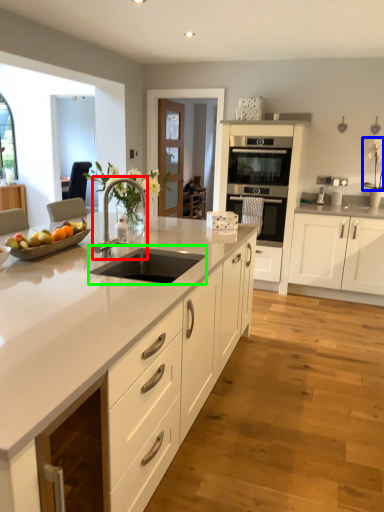
Question: Which is farther away from tap (highlighted by a red box)? flower (highlighted by a blue box) or sink (highlighted by a green box)?

Choices:
 (A) flower
 (B) sink

Answer: (A)